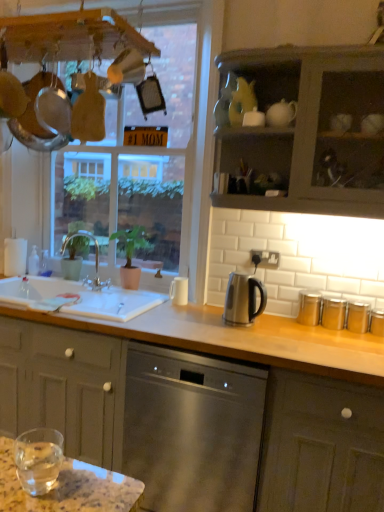
What are the coordinates of `vacant area on top of matte gray cabinet at lower right, the first cabinetry from the bottom (from a real-world perspective)` in the screenshot? It's located at (331, 342).